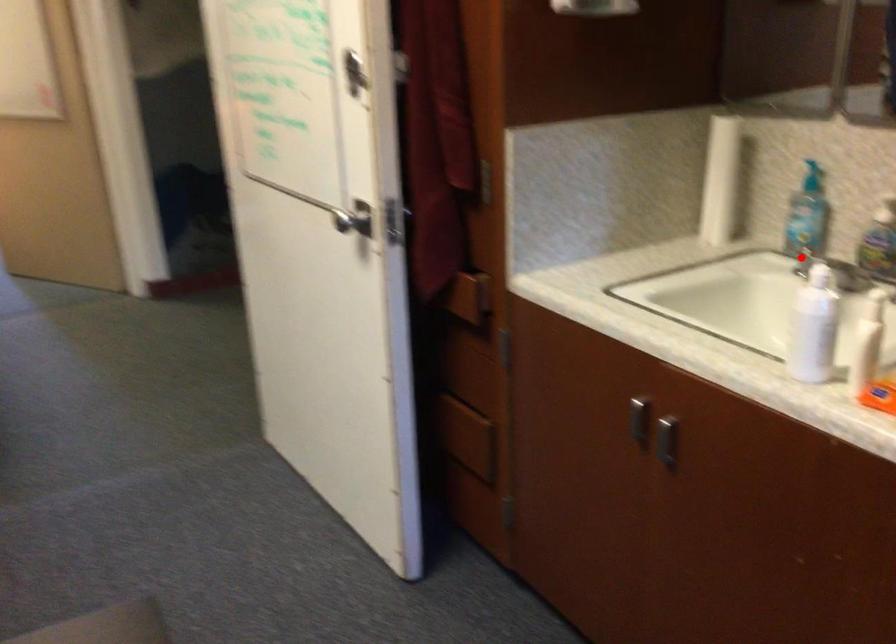
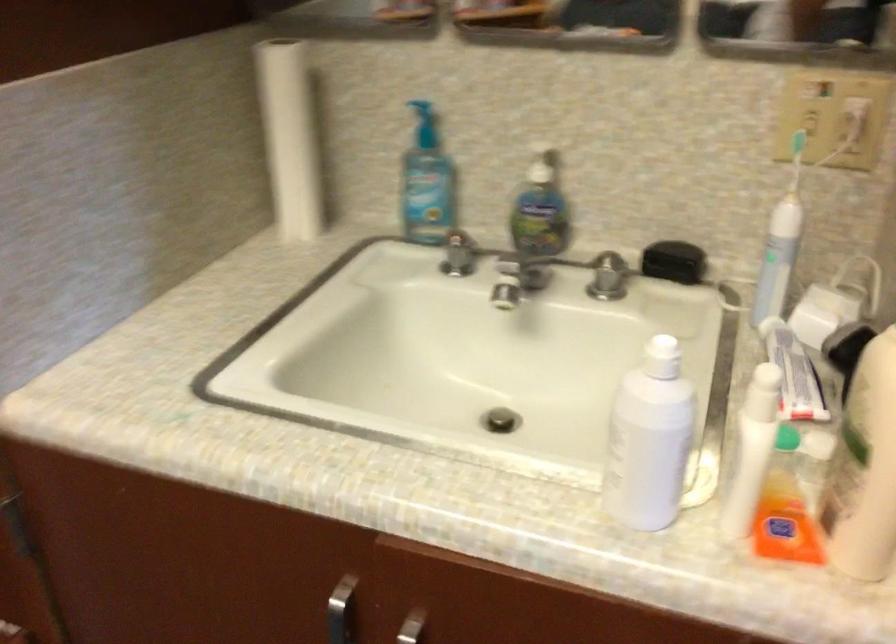
Where in the second image is the point corresponding to the highlighted location from the first image?

(458, 254)